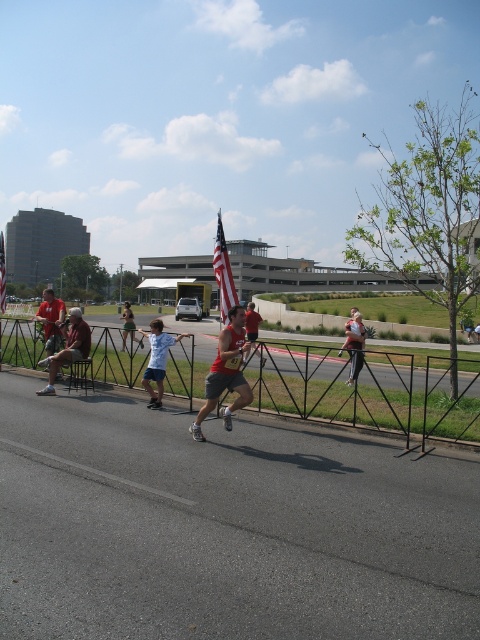
Question: Is black metal fence at center smaller than matte red shirt at left?

Choices:
 (A) no
 (B) yes

Answer: (A)

Question: Which object is positioned farthest from the american flag at center?

Choices:
 (A) matte gray shorts at left
 (B) matte red shirt at left
 (C) light blue t-shirt at center

Answer: (B)

Question: Which point is closer to the camera?

Choices:
 (A) matte gray shorts at left
 (B) light blue t-shirt at center
 (C) red matte shirt at center

Answer: (C)

Question: In this image, where is light blue t-shirt at center located relative to american flag at center?

Choices:
 (A) above
 (B) below

Answer: (B)

Question: Which point appears closest to the camera in this image?

Choices:
 (A) (170, 369)
 (B) (217, 346)
 (C) (81, 324)
 (D) (154, 378)

Answer: (D)

Question: Can you confirm if red matte shirt at center is thinner than matte gray shorts at left?

Choices:
 (A) yes
 (B) no

Answer: (A)